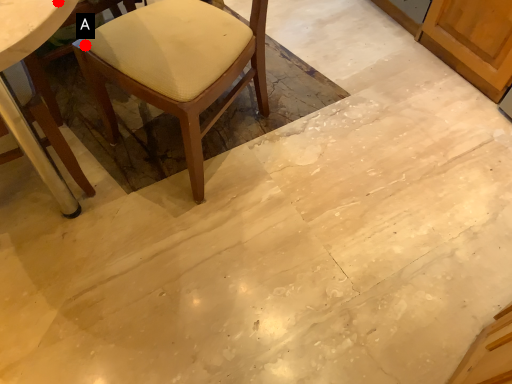
Question: Two points are circled on the image, labeled by A and B beside each circle. Among these points, which one is nearest to the camera?

Choices:
 (A) A is closer
 (B) B is closer

Answer: (B)